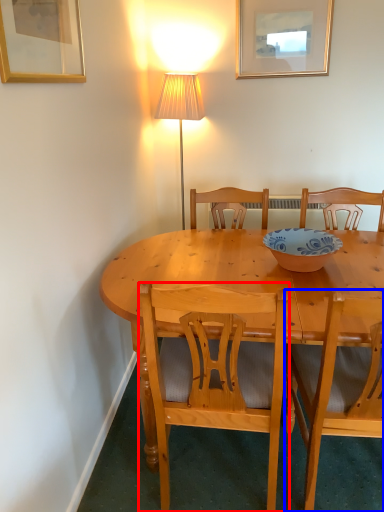
Question: Which point is further to the camera, chair (highlighted by a red box) or chair (highlighted by a blue box)?

Choices:
 (A) chair
 (B) chair

Answer: (A)